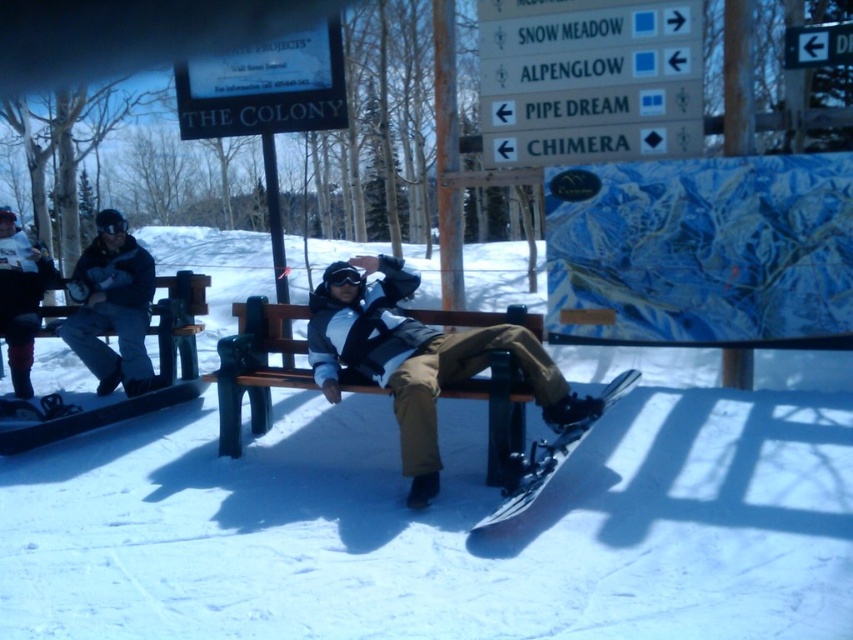
Does matte black snowboard at center have a lesser width compared to brushed metal snowboard at left?

No.

Does matte black snowboard at center have a smaller size compared to brushed metal snowboard at left?

Actually, matte black snowboard at center might be larger than brushed metal snowboard at left.

Is point (407, 276) positioned before point (41, 275)?

Yes, point (407, 276) is closer to viewer.

Find the location of a particular element. The height and width of the screenshot is (640, 853). matte black snowboard at center is located at coordinates (416, 358).

Can you confirm if brown wooden bench at center is wider than brushed metal snowboard at left?

Yes.

Is brown wooden bench at center positioned at the back of brushed metal snowboard at left?

That is False.

What do you see at coordinates (254, 365) in the screenshot? This screenshot has height=640, width=853. I see `brown wooden bench at center` at bounding box center [254, 365].

The image size is (853, 640). Identify the location of brown wooden bench at center. (254, 365).

Describe the element at coordinates (450, 518) in the screenshot. I see `white matte snowboard at center` at that location.

Is point (677, 499) closer to viewer compared to point (422, 401)?

Yes, it is.

I want to click on white matte snowboard at center, so click(x=450, y=518).